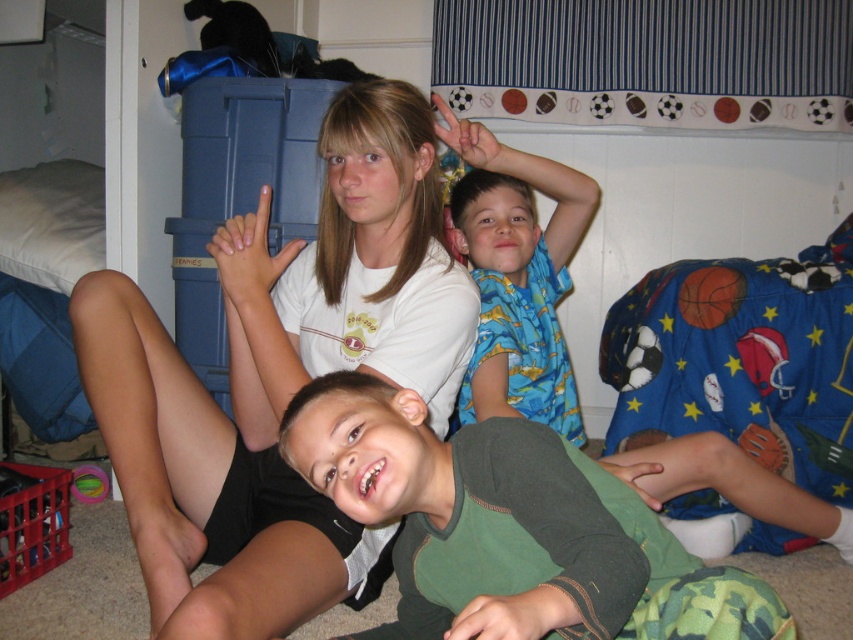
You are a parent trying to retrieve the green rubber ball at lower left for your child. The white matte shirt at upper center belongs to another child. Can you reach the ball without moving the shirt?

The white matte shirt at upper center and green rubber ball at lower left are 38.70 inches apart, so yes, you can reach the ball without moving the shirt since they are separated by a sufficient distance.

You are a photographer taking a picture of the children in the scene. You want to focus on the child in the foreground and the child on the left. Which of these two points, point 1 at coordinates point (368, 216) or point 2 at coordinates point (531, 156), is closer to the camera?

Point 1 at coordinates point (368, 216) is closer to the camera than point 2 at coordinates point (531, 156).

You are a photographer trying to capture a closeup of the two points in the image. Which point, point [503,344] or point [74,472], is closer to your camera lens?

Point [503,344] is closer to the camera than point [74,472].